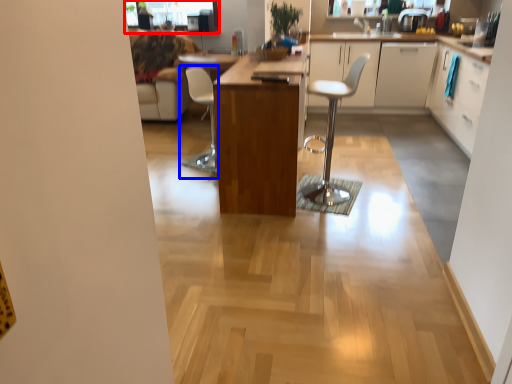
Question: Which point is closer to the camera, window screen (highlighted by a red box) or chair (highlighted by a blue box)?

Choices:
 (A) window screen
 (B) chair

Answer: (B)